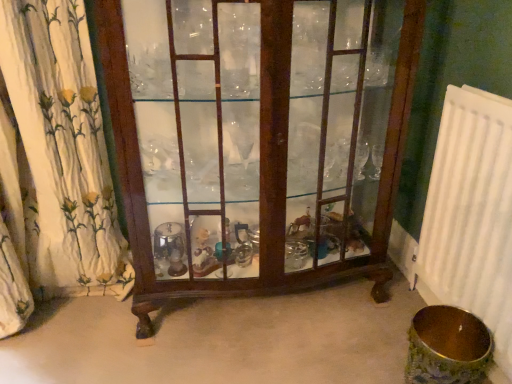
Image resolution: width=512 pixels, height=384 pixels. I want to click on free space below white floral fabric at left (from a real-world perspective), so click(x=59, y=315).